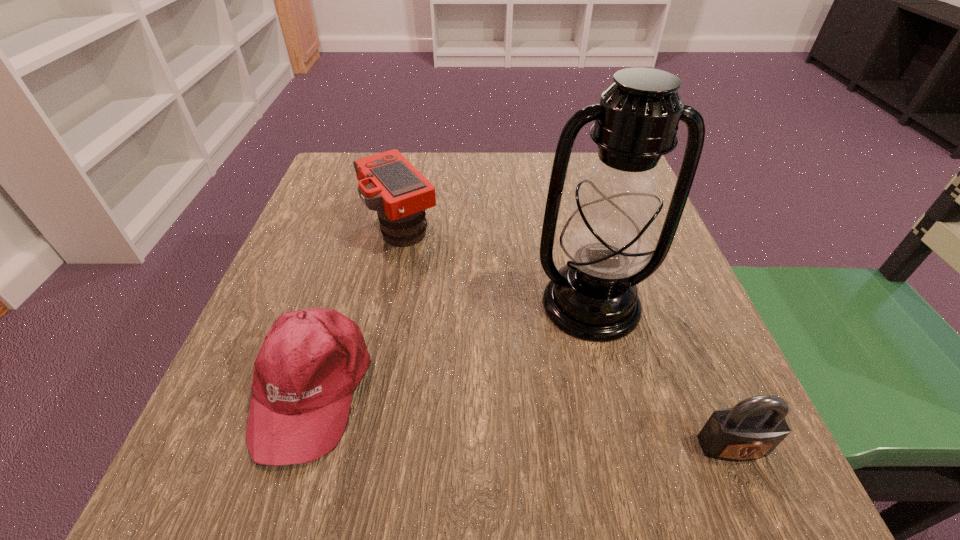
This screenshot has width=960, height=540. I want to click on vacant space at the far left corner of the desktop, so click(326, 170).

Locate an element on the screen. vacant region at the far right corner of the desktop is located at coordinates (572, 171).

This screenshot has width=960, height=540. In order to click on free space at the near right corner of the desktop in this screenshot , I will do `click(661, 493)`.

Where is `blank region between the baseball cap and the oil lamp`? The height and width of the screenshot is (540, 960). blank region between the baseball cap and the oil lamp is located at coordinates (451, 346).

You are a GUI agent. You are given a task and a screenshot of the screen. Output one action in this format:
    pyautogui.click(x=<x>, y=<y>)
    Task: Click on the free space between the farthest object and the oil lamp
    The height and width of the screenshot is (540, 960).
    Given the screenshot: What is the action you would take?
    pyautogui.click(x=495, y=266)

Where is `free point between the padlock and the camera`? This screenshot has height=540, width=960. free point between the padlock and the camera is located at coordinates (566, 338).

Where is `empty space that is in between the baseball cap and the farthest object`? This screenshot has height=540, width=960. empty space that is in between the baseball cap and the farthest object is located at coordinates (356, 308).

The height and width of the screenshot is (540, 960). Identify the location of free space that is in between the farthest object and the tallest object. (495, 266).

Locate an element on the screen. vacant area that lies between the padlock and the oil lamp is located at coordinates (661, 375).

The height and width of the screenshot is (540, 960). I want to click on free space between the padlock and the farthest object, so tap(566, 338).